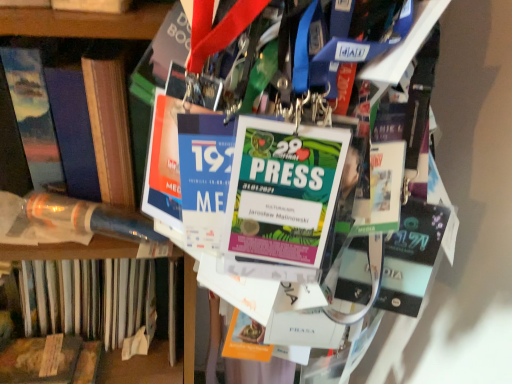
The height and width of the screenshot is (384, 512). What do you see at coordinates (132, 332) in the screenshot?
I see `translucent plastic tube at left, the third book viewed from the right` at bounding box center [132, 332].

What do you see at coordinates (155, 78) in the screenshot?
I see `hardcover book at left, arranged as the 4th book when viewed from the left` at bounding box center [155, 78].

This screenshot has width=512, height=384. Find the location of `matte blue book at left, the 2th book in the right-to-left sequence`. matte blue book at left, the 2th book in the right-to-left sequence is located at coordinates (89, 114).

Measure the distance from translucent plastic tube at left, the third book viewed from the right, to matte blue book at left, the 2th book in the right-to-left sequence.

The distance of translucent plastic tube at left, the third book viewed from the right, from matte blue book at left, the 2th book in the right-to-left sequence, is 11.08 inches.

Consider the image. From a real-world perspective, is translucent plastic tube at left, the third book viewed from the right, physically above matte blue book at left, positioned as the 3th book in left-to-right order?

No, from a real-world perspective, translucent plastic tube at left, the third book viewed from the right, is not over matte blue book at left, positioned as the 3th book in left-to-right order

Would you consider translucent plastic tube at left, the third book viewed from the right, to be distant from matte blue book at left, the 2th book in the right-to-left sequence?

No, translucent plastic tube at left, the third book viewed from the right, is not far from matte blue book at left, the 2th book in the right-to-left sequence.

Which of these two, translucent plastic tube at left, which appears as the second book when viewed from the left, or matte blue book at left, positioned as the 3th book in left-to-right order, is thinner?

translucent plastic tube at left, which appears as the second book when viewed from the left, is thinner.

Can you confirm if hardcover book at left, the first book when ordered from right to left, is thinner than translucent plastic tube at left, which appears as the second book when viewed from the left?

Incorrect, the width of hardcover book at left, the first book when ordered from right to left, is not less than that of translucent plastic tube at left, which appears as the second book when viewed from the left.

From the hardcover book at left, the first book when ordered from right to left, count 2nd books backward and point to it. Please provide its 2D coordinates.

[(132, 332)]

Is translucent plastic tube at left, the third book viewed from the right, at the back of hardcover book at left, the first book when ordered from right to left?

That's not correct — hardcover book at left, the first book when ordered from right to left, is not looking away from translucent plastic tube at left, the third book viewed from the right.

Are hardcover book at left, arranged as the 4th book when viewed from the left, and translucent plastic tube at left, which appears as the second book when viewed from the left, beside each other?

No, hardcover book at left, arranged as the 4th book when viewed from the left, is not with translucent plastic tube at left, which appears as the second book when viewed from the left.

Can you confirm if matte blue book at left, the 2th book in the right-to-left sequence, is positioned to the right of hardcover book at left, arranged as the 4th book when viewed from the left?

Incorrect, matte blue book at left, the 2th book in the right-to-left sequence, is not on the right side of hardcover book at left, arranged as the 4th book when viewed from the left.

Which of these two, matte blue book at left, positioned as the 3th book in left-to-right order, or hardcover book at left, arranged as the 4th book when viewed from the left, is wider?

hardcover book at left, arranged as the 4th book when viewed from the left, is wider.

Does point (103, 161) lie behind point (144, 77)?

Yes.

Consider the image. From a real-world perspective, is matte blue book at left, the 2th book in the right-to-left sequence, above or below hardcover book at left, the first book when ordered from right to left?

Clearly, from a real-world perspective, matte blue book at left, the 2th book in the right-to-left sequence, is above hardcover book at left, the first book when ordered from right to left.

Would you say hardcover book at left, arranged as the 4th book when viewed from the left, is a long distance from wooden plank at lower left, arranged as the first book when viewed from the left?

No, hardcover book at left, arranged as the 4th book when viewed from the left, is not far away from wooden plank at lower left, arranged as the first book when viewed from the left.

Based on the photo, is hardcover book at left, arranged as the 4th book when viewed from the left, oriented towards wooden plank at lower left, arranged as the first book when viewed from the left?

No, hardcover book at left, arranged as the 4th book when viewed from the left, does not turn towards wooden plank at lower left, arranged as the first book when viewed from the left.

Considering the relative sizes of hardcover book at left, arranged as the 4th book when viewed from the left, and wooden plank at lower left, which is the fourth book in right-to-left order, in the image provided, is hardcover book at left, arranged as the 4th book when viewed from the left, bigger than wooden plank at lower left, which is the fourth book in right-to-left order,?

Correct, hardcover book at left, arranged as the 4th book when viewed from the left, is larger in size than wooden plank at lower left, which is the fourth book in right-to-left order.

Relative to wooden plank at lower left, which is the fourth book in right-to-left order, is translucent plastic tube at left, the third book viewed from the right, in front or behind?

Clearly, translucent plastic tube at left, the third book viewed from the right, is in front of wooden plank at lower left, which is the fourth book in right-to-left order.

Who is smaller, translucent plastic tube at left, the third book viewed from the right, or wooden plank at lower left, which is the fourth book in right-to-left order?

With smaller size is wooden plank at lower left, which is the fourth book in right-to-left order.

From a real-world perspective, is translucent plastic tube at left, the third book viewed from the right, physically below wooden plank at lower left, which is the fourth book in right-to-left order?

No.

Is translucent plastic tube at left, the third book viewed from the right, not near wooden plank at lower left, which is the fourth book in right-to-left order?

No, translucent plastic tube at left, the third book viewed from the right, is not far from wooden plank at lower left, which is the fourth book in right-to-left order.

Can you tell me how much matte blue book at left, the 2th book in the right-to-left sequence, and translucent plastic tube at left, which appears as the second book when viewed from the left, differ in facing direction?

The angle between the facing direction of matte blue book at left, the 2th book in the right-to-left sequence, and the facing direction of translucent plastic tube at left, which appears as the second book when viewed from the left, is 2.63 degrees.

Is matte blue book at left, the 2th book in the right-to-left sequence, at the left side of translucent plastic tube at left, which appears as the second book when viewed from the left?

In fact, matte blue book at left, the 2th book in the right-to-left sequence, is to the right of translucent plastic tube at left, which appears as the second book when viewed from the left.

Which is behind, point (79, 94) or point (83, 276)?

The point (83, 276) is farther from the camera.

From the image's perspective, between matte blue book at left, positioned as the 3th book in left-to-right order, and translucent plastic tube at left, the third book viewed from the right, who is located below?

translucent plastic tube at left, the third book viewed from the right, is shown below in the image.

Are wooden plank at lower left, which is the fourth book in right-to-left order, and hardcover book at left, the first book when ordered from right to left, far apart?

wooden plank at lower left, which is the fourth book in right-to-left order, is near hardcover book at left, the first book when ordered from right to left, not far away.

Is wooden plank at lower left, arranged as the first book when viewed from the left, positioned beyond the bounds of hardcover book at left, arranged as the 4th book when viewed from the left?

wooden plank at lower left, arranged as the first book when viewed from the left, lies outside hardcover book at left, arranged as the 4th book when viewed from the left,'s area.

Is wooden plank at lower left, arranged as the first book when viewed from the left, wider than hardcover book at left, arranged as the 4th book when viewed from the left?

No, wooden plank at lower left, arranged as the first book when viewed from the left, is not wider than hardcover book at left, arranged as the 4th book when viewed from the left.

Where is `the 1st book in front of the translucent plastic tube at left, which appears as the second book when viewed from the left`? the 1st book in front of the translucent plastic tube at left, which appears as the second book when viewed from the left is located at coordinates (89, 114).

The width and height of the screenshot is (512, 384). Identify the location of the 2nd book behind the hardcover book at left, the first book when ordered from right to left. (132, 332).

When comparing their distances from hardcover book at left, arranged as the 4th book when viewed from the left, does matte blue book at left, positioned as the 3th book in left-to-right order, or wooden plank at lower left, arranged as the first book when viewed from the left, seem further?

wooden plank at lower left, arranged as the first book when viewed from the left, is further to hardcover book at left, arranged as the 4th book when viewed from the left.

Estimate the real-world distances between objects in this image. Which object is closer to wooden plank at lower left, which is the fourth book in right-to-left order, translucent plastic tube at left, which appears as the second book when viewed from the left, or hardcover book at left, the first book when ordered from right to left?

translucent plastic tube at left, which appears as the second book when viewed from the left, lies closer to wooden plank at lower left, which is the fourth book in right-to-left order, than the other object.

Based on their spatial positions, is matte blue book at left, the 2th book in the right-to-left sequence, or translucent plastic tube at left, the third book viewed from the right, further from wooden plank at lower left, arranged as the first book when viewed from the left?

matte blue book at left, the 2th book in the right-to-left sequence, is further to wooden plank at lower left, arranged as the first book when viewed from the left.

Considering their positions, is wooden plank at lower left, arranged as the first book when viewed from the left, positioned closer to translucent plastic tube at left, which appears as the second book when viewed from the left, than matte blue book at left, the 2th book in the right-to-left sequence?

Based on the image, wooden plank at lower left, arranged as the first book when viewed from the left, appears to be nearer to translucent plastic tube at left, which appears as the second book when viewed from the left.

Considering their positions, is hardcover book at left, arranged as the 4th book when viewed from the left, positioned further to translucent plastic tube at left, which appears as the second book when viewed from the left, than matte blue book at left, the 2th book in the right-to-left sequence?

Based on the image, hardcover book at left, arranged as the 4th book when viewed from the left, appears to be further to translucent plastic tube at left, which appears as the second book when viewed from the left.

Estimate the real-world distances between objects in this image. Which object is closer to hardcover book at left, the first book when ordered from right to left, matte blue book at left, positioned as the 3th book in left-to-right order, or translucent plastic tube at left, the third book viewed from the right?

matte blue book at left, positioned as the 3th book in left-to-right order.

Based on their spatial positions, is translucent plastic tube at left, the third book viewed from the right, or hardcover book at left, the first book when ordered from right to left, closer to matte blue book at left, positioned as the 3th book in left-to-right order?

The object closer to matte blue book at left, positioned as the 3th book in left-to-right order, is hardcover book at left, the first book when ordered from right to left.

Based on their spatial positions, is wooden plank at lower left, arranged as the first book when viewed from the left, or hardcover book at left, the first book when ordered from right to left, closer to translucent plastic tube at left, the third book viewed from the right?

Among the two, wooden plank at lower left, arranged as the first book when viewed from the left, is located nearer to translucent plastic tube at left, the third book viewed from the right.

In order to click on book between hardcover book at left, the first book when ordered from right to left, and translucent plastic tube at left, the third book viewed from the right, along the z-axis in this screenshot , I will do `click(89, 114)`.